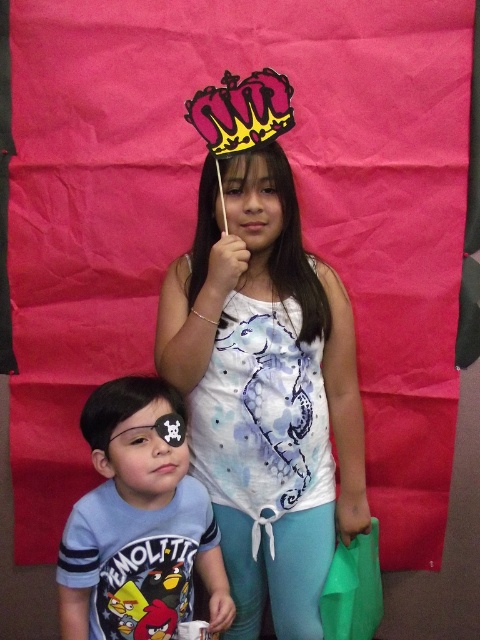
You are organizing a photo shoot and need to position a matte white tank top at center in the scene. Based on the description, where should you place it to ensure it aligns with the existing elements?

The matte white tank top at center should be placed at the coordinates point (264,364) to align with the existing elements as specified in the description.

You are a photographer setting up a photo shoot with two children. You have a matte white tank top at center and a blue cotton shirt at lower left in the scene. Which clothing item is closer to you?

The matte white tank top at center is closer to you because it is further to the viewer than the blue cotton shirt at lower left.